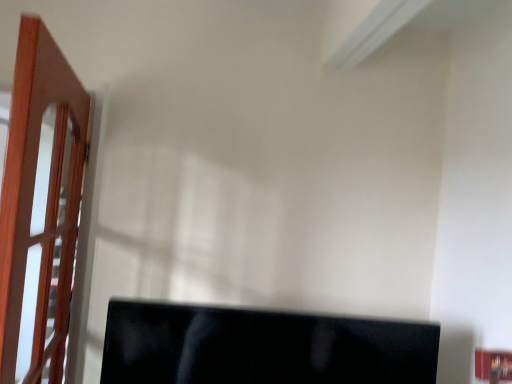
Question: Does light brown wooden door at left turn towards black glossy monitor at lower center?

Choices:
 (A) yes
 (B) no

Answer: (B)

Question: From a real-world perspective, does light brown wooden door at left stand above black glossy monitor at lower center?

Choices:
 (A) no
 (B) yes

Answer: (B)

Question: Are light brown wooden door at left and black glossy monitor at lower center beside each other?

Choices:
 (A) no
 (B) yes

Answer: (A)

Question: Can black glossy monitor at lower center be found inside light brown wooden door at left?

Choices:
 (A) yes
 (B) no

Answer: (B)

Question: Considering the relative positions of light brown wooden door at left and black glossy monitor at lower center in the image provided, is light brown wooden door at left to the right of black glossy monitor at lower center from the viewer's perspective?

Choices:
 (A) no
 (B) yes

Answer: (A)

Question: Considering the relative sizes of light brown wooden door at left and black glossy monitor at lower center in the image provided, is light brown wooden door at left thinner than black glossy monitor at lower center?

Choices:
 (A) no
 (B) yes

Answer: (B)

Question: Could light brown wooden door at left be considered to be inside black glossy monitor at lower center?

Choices:
 (A) yes
 (B) no

Answer: (B)

Question: From the image's perspective, would you say black glossy monitor at lower center is positioned over light brown wooden door at left?

Choices:
 (A) yes
 (B) no

Answer: (B)

Question: Is black glossy monitor at lower center not near light brown wooden door at left?

Choices:
 (A) yes
 (B) no

Answer: (B)

Question: Is black glossy monitor at lower center to the left of light brown wooden door at left from the viewer's perspective?

Choices:
 (A) no
 (B) yes

Answer: (A)

Question: From a real-world perspective, is black glossy monitor at lower center under light brown wooden door at left?

Choices:
 (A) no
 (B) yes

Answer: (B)

Question: Is black glossy monitor at lower center thinner than light brown wooden door at left?

Choices:
 (A) yes
 (B) no

Answer: (B)

Question: In the image, is light brown wooden door at left on the left side or the right side of black glossy monitor at lower center?

Choices:
 (A) left
 (B) right

Answer: (A)